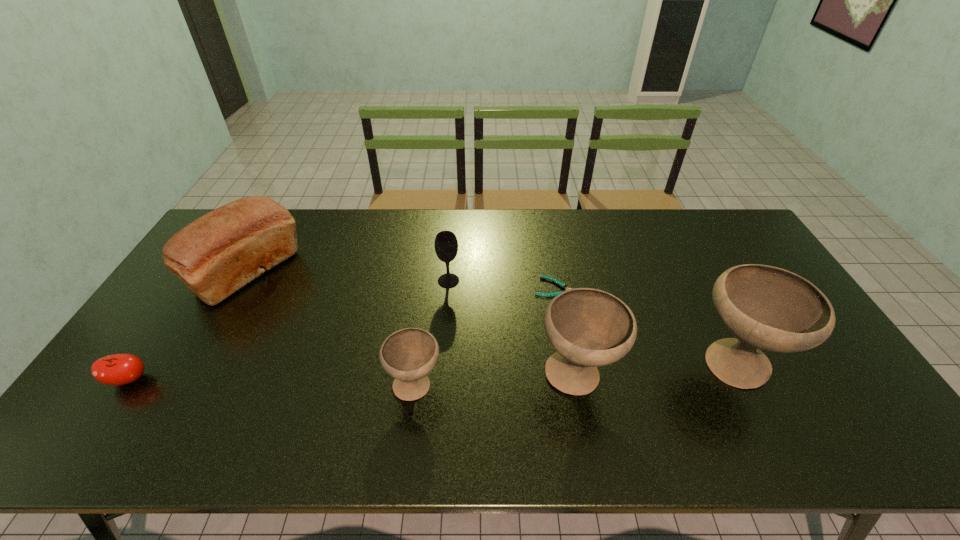
This screenshot has width=960, height=540. What are the coordinates of `vacant region located on the back of the rightmost chalice` in the screenshot? It's located at (708, 315).

Locate an element on the screen. vacant space located 0.100m on the back of the fourth shortest object is located at coordinates (450, 253).

This screenshot has height=540, width=960. In order to click on free space located on the left of the bread in this screenshot , I will do `click(185, 273)`.

You are a GUI agent. You are given a task and a screenshot of the screen. Output one action in this format:
    pyautogui.click(x=<x>, y=<y>)
    Task: Click on the free space located on the right of the apple
    The height and width of the screenshot is (540, 960).
    Given the screenshot: What is the action you would take?
    pyautogui.click(x=255, y=380)

Locate an element on the screen. vacant space located 0.120m on the left of the pliers is located at coordinates 495,287.

Locate an element on the screen. The image size is (960, 540). object located at the far edge is located at coordinates (216, 255).

Locate an element on the screen. Image resolution: width=960 pixels, height=540 pixels. apple situated at the near edge is located at coordinates (118, 369).

You are a GUI agent. You are given a task and a screenshot of the screen. Output one action in this format:
    pyautogui.click(x=<x>, y=<y>)
    Task: Click on the bread present at the left edge
    The width and height of the screenshot is (960, 540).
    Given the screenshot: What is the action you would take?
    pyautogui.click(x=216, y=255)

The height and width of the screenshot is (540, 960). I want to click on apple positioned at the left edge, so click(x=118, y=369).

At what (x,y) coordinates should I click in order to perform the action: click on object present at the right edge. Please return your answer as a coordinate pair (x, y). This screenshot has width=960, height=540. Looking at the image, I should click on (767, 308).